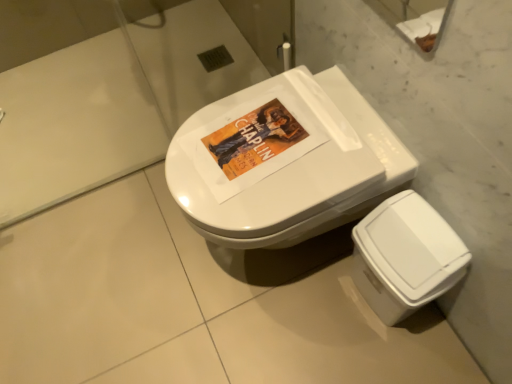
This screenshot has width=512, height=384. What do you see at coordinates (405, 256) in the screenshot?
I see `white plastic bidet at lower right` at bounding box center [405, 256].

In order to face white plastic bidet at lower right, should I rotate leftwards or rightwards?

You should look right and rotate roughly 18.745 degrees.

Measure the distance between point [449,271] and camera.

Point [449,271] and camera are 35.24 inches apart from each other.

At what (x,y) coordinates should I click in order to perform the action: click on white plastic bidet at lower right. Please return your answer as a coordinate pair (x, y). Looking at the image, I should click on (405, 256).

In order to face white glossy toilet at center, should I rotate leftwards or rightwards?

Rotate your view right by about 2.526°.

What is the approximate height of white glossy toilet at center?

white glossy toilet at center is 44.56 centimeters in height.

This screenshot has height=384, width=512. What do you see at coordinates (286, 162) in the screenshot? I see `white glossy toilet at center` at bounding box center [286, 162].

The height and width of the screenshot is (384, 512). I want to click on white glossy toilet at center, so click(x=286, y=162).

In order to click on white plastic bidet at lower right in this screenshot , I will do `click(405, 256)`.

Based on their positions, is white glossy toilet at center located to the left or right of white plastic bidet at lower right?

Based on their positions, white glossy toilet at center is located to the left of white plastic bidet at lower right.

In the image, is white glossy toilet at center positioned in front of or behind white plastic bidet at lower right?

Visually, white glossy toilet at center is located in front of white plastic bidet at lower right.

Considering the points (368, 135) and (419, 242), which point is in front, point (368, 135) or point (419, 242)?

The point (419, 242) is closer.

From the image's perspective, is white glossy toilet at center on white plastic bidet at lower right?

Yes, from the image's perspective, white glossy toilet at center is above white plastic bidet at lower right.

From a real-world perspective, relative to white plastic bidet at lower right, is white glossy toilet at center vertically above or below?

white glossy toilet at center is above white plastic bidet at lower right.

Which of these two, white glossy toilet at center or white plastic bidet at lower right, is wider?

Wider between the two is white glossy toilet at center.

Which of these two, white glossy toilet at center or white plastic bidet at lower right, stands taller?

With more height is white glossy toilet at center.

From the picture: Between white glossy toilet at center and white plastic bidet at lower right, which one has larger size?

Bigger between the two is white glossy toilet at center.

Is white glossy toilet at center located outside white plastic bidet at lower right?

Yes, white glossy toilet at center is not within white plastic bidet at lower right.

From the picture: Is white glossy toilet at center in contact with white plastic bidet at lower right?

No, white glossy toilet at center is not next to white plastic bidet at lower right.

Does white glossy toilet at center turn towards white plastic bidet at lower right?

No, white glossy toilet at center does not turn towards white plastic bidet at lower right.

Find the location of `toilet positioned vertically above the white plastic bidet at lower right (from a real-world perspective)`. toilet positioned vertically above the white plastic bidet at lower right (from a real-world perspective) is located at coordinates (286, 162).

In the scene shown: Considering the positions of objects white plastic bidet at lower right and white glossy toilet at center in the image provided, who is more to the right, white plastic bidet at lower right or white glossy toilet at center?

white plastic bidet at lower right.

In the scene shown: Which object is more forward, white plastic bidet at lower right or white glossy toilet at center?

white glossy toilet at center.

Does point (436, 287) come closer to viewer compared to point (403, 179)?

Yes, point (436, 287) is in front of point (403, 179).

From the image's perspective, which is below, white plastic bidet at lower right or white glossy toilet at center?

white plastic bidet at lower right, from the image's perspective.

From a real-world perspective, which is physically below, white plastic bidet at lower right or white glossy toilet at center?

white plastic bidet at lower right, from a real-world perspective.

Does white plastic bidet at lower right have a greater width compared to white glossy toilet at center?

No, white plastic bidet at lower right is not wider than white glossy toilet at center.

Considering the relative sizes of white plastic bidet at lower right and white glossy toilet at center in the image provided, is white plastic bidet at lower right shorter than white glossy toilet at center?

Correct, white plastic bidet at lower right is not as tall as white glossy toilet at center.

Considering the relative sizes of white plastic bidet at lower right and white glossy toilet at center in the image provided, is white plastic bidet at lower right bigger than white glossy toilet at center?

Incorrect, white plastic bidet at lower right is not larger than white glossy toilet at center.

Is white plastic bidet at lower right inside or outside of white glossy toilet at center?

white plastic bidet at lower right is located beyond the bounds of white glossy toilet at center.

Is white plastic bidet at lower right with white glossy toilet at center?

No.

Is white plastic bidet at lower right aimed at white glossy toilet at center?

No, white plastic bidet at lower right is not facing towards white glossy toilet at center.

How distant is white plastic bidet at lower right from white glossy toilet at center?

white plastic bidet at lower right is 8.67 inches away from white glossy toilet at center.

In the image, there is a white glossy toilet at center. Identify the location of bidet below it (from the image's perspective). This screenshot has width=512, height=384. (405, 256).

Locate an element on the screen. This screenshot has height=384, width=512. bidet below the white glossy toilet at center (from the image's perspective) is located at coordinates (405, 256).

Locate an element on the screen. toilet in front of the white plastic bidet at lower right is located at coordinates (286, 162).